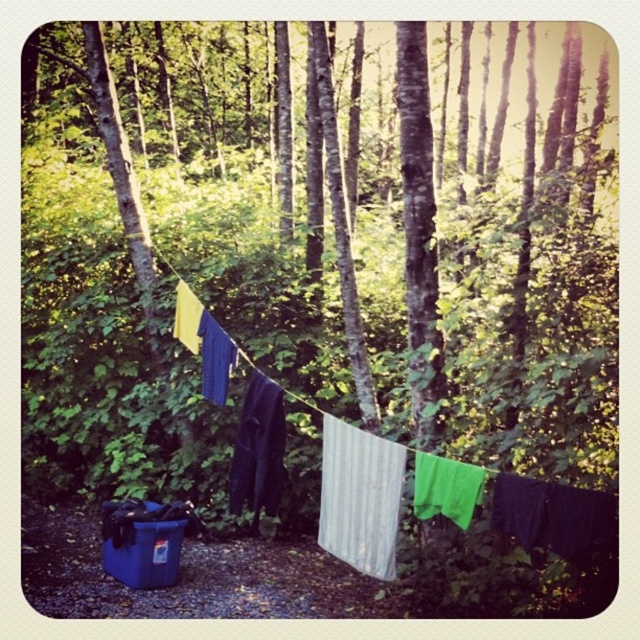
You are planning to set up a picnic in this wooded area. You need to know if the blue plastic cooler at lower left can fit under the dark blue fabric at center. Can it fit vertically?

The blue plastic cooler at lower left is not as tall as dark blue fabric at center, so it can fit vertically under the dark blue fabric at center.

You are setting up a small outdoor market stall in this wooded area. You have two items to display on a shelf at the center of your stall. The white corrugated plastic at center and the dark blue fabric at center. Which item should you choose to fit better on a shelf that can only accommodate the wider item?

The white corrugated plastic at center should be chosen because its width is larger than the dark blue fabric at center, making it the better fit for the shelf that requires the wider item.